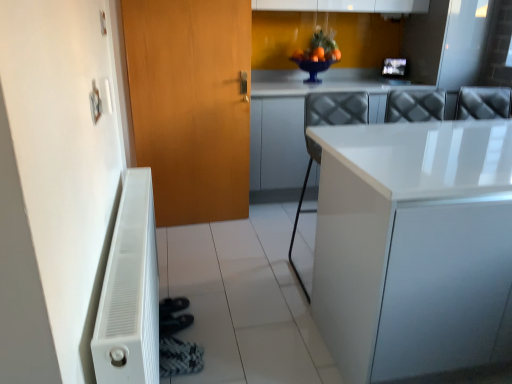
Question: Considering the relative positions of wooden door at left and black textured shoe at lower left in the image provided, is wooden door at left to the left or to the right of black textured shoe at lower left?

Choices:
 (A) left
 (B) right

Answer: (A)

Question: Choose the correct answer: Is wooden door at left inside black textured shoe at lower left or outside it?

Choices:
 (A) outside
 (B) inside

Answer: (A)

Question: Estimate the real-world distances between objects in this image. Which object is farther from the white matte radiator at lower left?

Choices:
 (A) wooden door at left
 (B) white glossy counter top at upper right
 (C) white glossy chair at center
 (D) black textured shoe at lower left
 (E) white glossy countertop at center

Answer: (B)

Question: Which of these objects is positioned farthest from the wooden door at left?

Choices:
 (A) white matte radiator at lower left
 (B) white glossy countertop at center
 (C) black textured shoe at lower left
 (D) white glossy counter top at upper right
 (E) white glossy chair at center

Answer: (B)